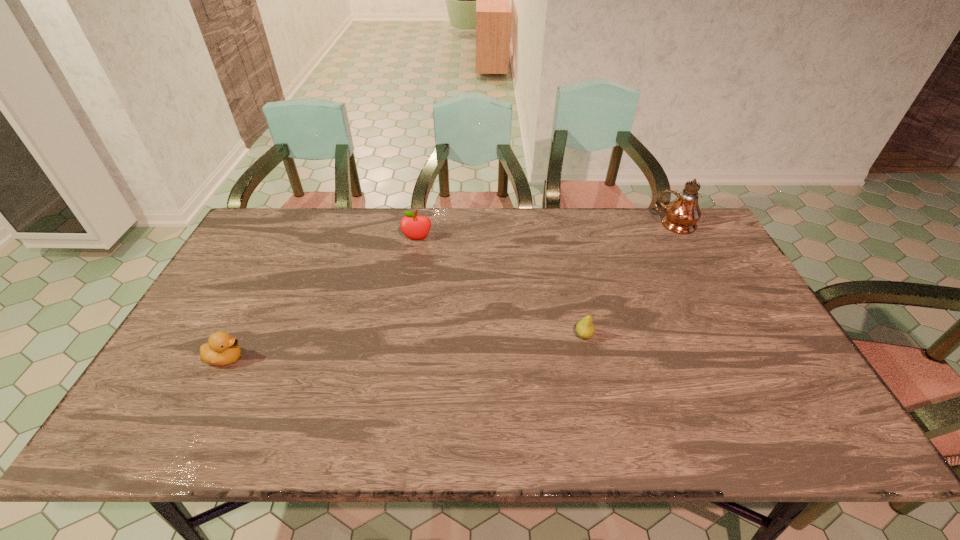
At what (x,y) coordinates should I click in order to perform the action: click on the tallest object. Please return your answer as a coordinate pair (x, y). The height and width of the screenshot is (540, 960). Looking at the image, I should click on (682, 214).

This screenshot has height=540, width=960. What are the coordinates of `the farthest object` in the screenshot? It's located at point(682,214).

Find the location of `the second object from left to right`. the second object from left to right is located at coordinates 413,226.

In order to click on the second farthest object in this screenshot , I will do `click(413, 226)`.

Where is `pear`? Image resolution: width=960 pixels, height=540 pixels. pear is located at coordinates tap(585, 328).

Find the location of a particular element. The height and width of the screenshot is (540, 960). the third object from left to right is located at coordinates (585, 328).

Image resolution: width=960 pixels, height=540 pixels. Find the location of `the nearest object`. the nearest object is located at coordinates (222, 349).

The width and height of the screenshot is (960, 540). I want to click on the leftmost object, so click(x=222, y=349).

Locate an element on the screen. The image size is (960, 540). free space located on the left of the tallest object is located at coordinates (563, 225).

Image resolution: width=960 pixels, height=540 pixels. I want to click on vacant space situated on the left of the third object from right to left, so (292, 239).